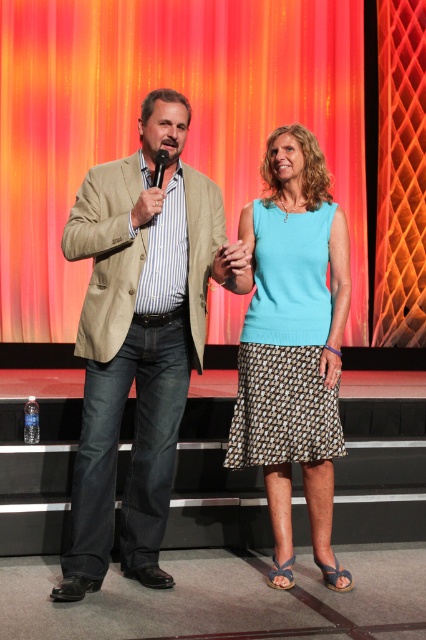
You are an event planner setting up the stage for a presentation. You need to ensure that the beige textured blazer at center and the black plastic microphone at upper center are visible to the audience. Based on their positions, which object is closer to the front of the stage?

The beige textured blazer at center is positioned under the black plastic microphone at upper center, meaning the microphone is closer to the front of the stage than the blazer.

You are an event planner setting up for a presentation. You need to ensure that the orange fabric curtain at upper center and the light blue fabric skirt at center are visible to the audience. Which object should you prioritize positioning closer to the front to ensure visibility?

The light blue fabric skirt at center should be positioned closer to the front because it is smaller in size than the orange fabric curtain at upper center, making it harder to see from a distance.

You are standing at the point labeled point (293, 29). You want to walk to the stage entrance located 10 meters away from you. If you walk straight ahead, will you reach the entrance before the stage ends?

The point labeled point (293, 29) is 6.95 meters away from the viewer. Since the entrance is 10 meters away, walking straight ahead would not reach the entrance before the stage ends. You need to adjust your path.